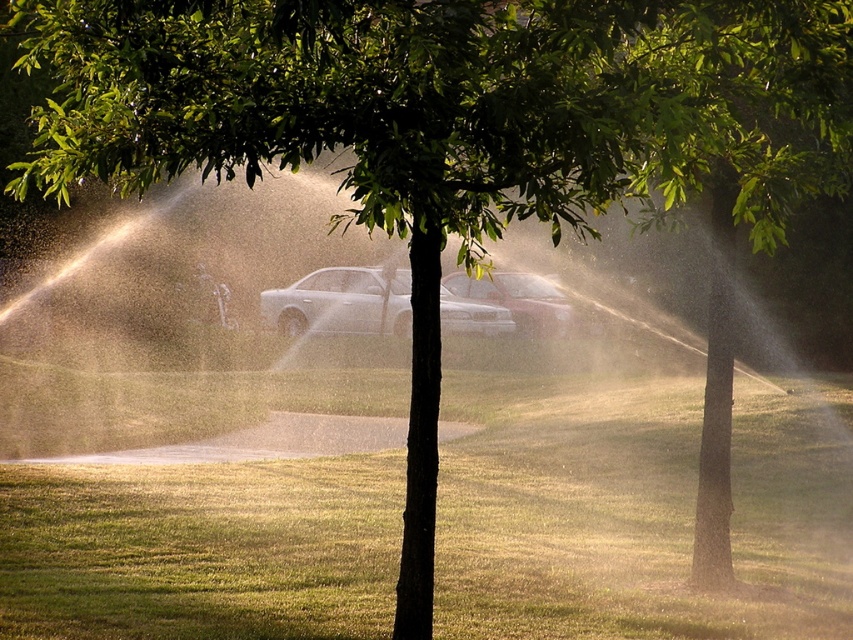
You are standing at the point marked by the coordinates point (326, 301). Looking around, you see a satin silver sedan at center. Which direction should you face to see the satin silver sedan at center?

You are already facing the satin silver sedan at center because you are standing at the point that represents its location.

From the picture: You are a photographer trying to capture both the satin silver sedan at center and the metallic silver sedan at center in a single shot. Which one should you focus on first if you want to ensure both are in sharp focus?

The satin silver sedan at center is located below the metallic silver sedan at center, so you should focus on the metallic silver sedan at center first to ensure both are in sharp focus.

Consider the image. You are a parking attendant who needs to fit both the satin silver sedan at center and the metallic silver sedan at center into a narrow parking spot. Which car should you park first to ensure both can fit?

The satin silver sedan at center is thinner than the metallic silver sedan at center, so you should park the metallic silver sedan at center first to allow space for the thinner satin silver sedan at center.